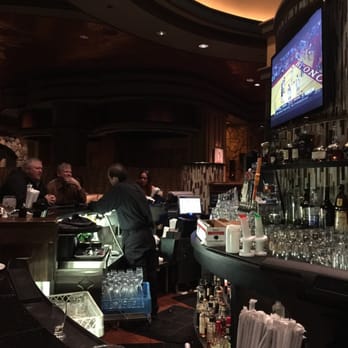
You are a GUI agent. You are given a task and a screenshot of the screen. Output one action in this format:
    pyautogui.click(x=<x>, y=<y>)
    Task: Click on the bar mat
    
    Given the screenshot: What is the action you would take?
    pyautogui.click(x=169, y=330)